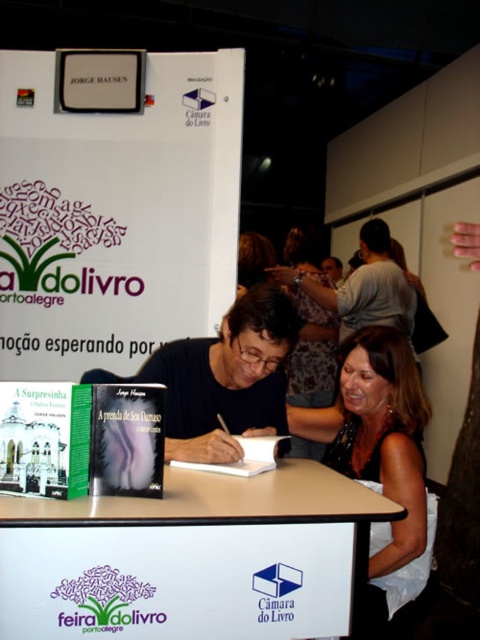
Can you confirm if white paperboard at upper center is thinner than white wood table at center?

In fact, white paperboard at upper center might be wider than white wood table at center.

I want to click on white paperboard at upper center, so click(x=116, y=214).

The width and height of the screenshot is (480, 640). What do you see at coordinates (116, 214) in the screenshot? I see `white paperboard at upper center` at bounding box center [116, 214].

Find the location of `white paperboard at upper center`. white paperboard at upper center is located at coordinates (116, 214).

Is point (168, 227) positioned before point (384, 380)?

No, (168, 227) is further to viewer.

Does white paperboard at upper center appear on the right side of matte black dress at center?

Incorrect, white paperboard at upper center is not on the right side of matte black dress at center.

Find the location of a particular element. The height and width of the screenshot is (640, 480). white paperboard at upper center is located at coordinates (116, 214).

At what (x,y) coordinates should I click in order to perform the action: click on white paperboard at upper center. Please return your answer as a coordinate pair (x, y). Looking at the image, I should click on (116, 214).

Does white wood table at center have a smaller size compared to matte black dress at center?

Indeed, white wood table at center has a smaller size compared to matte black dress at center.

Does white wood table at center come behind matte black dress at center?

That is False.

What are the coordinates of `white wood table at center` in the screenshot? It's located at (190, 557).